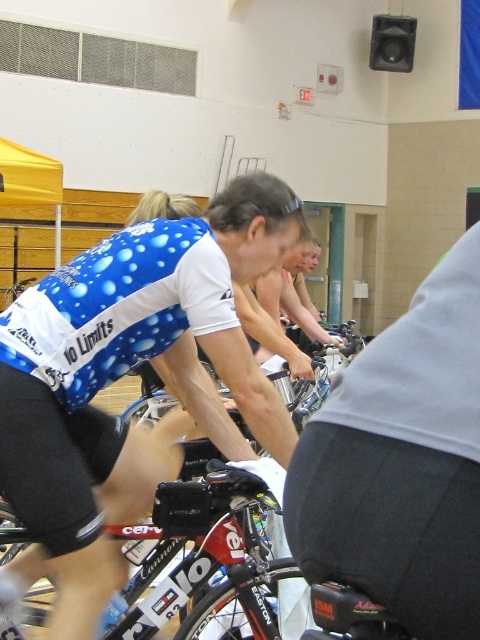
You are a photographer positioned at the back of the gymnasium. You want to capture a photo of the shiny red bicycle at center without the matte blue cycling jersey at center blocking the view. Is this possible based on their positions?

The matte blue cycling jersey at center is located above the shiny red bicycle at center, so it will block the direct line of sight. To capture the bicycle without obstruction, you may need to adjust your angle or position to avoid the jersey.

You are a photographer standing in the gymnasium and want to take a photo of both point (x=159, y=308) and point (x=400, y=570) in the image. Which point should you focus on first to ensure both are in sharp focus?

You should focus on point (x=159, y=308) first because it is closer to you than point (x=400, y=570), ensuring both points are within the depth of field.